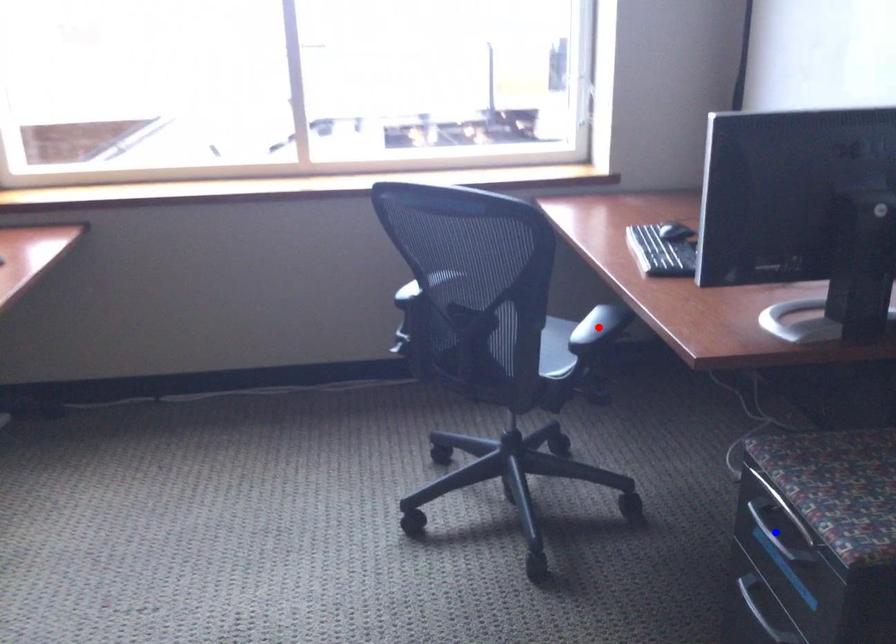
Question: In the image, two points are highlighted. Which point is nearer to the camera? Reply with the corresponding letter.

Choices:
 (A) blue point
 (B) red point

Answer: (A)